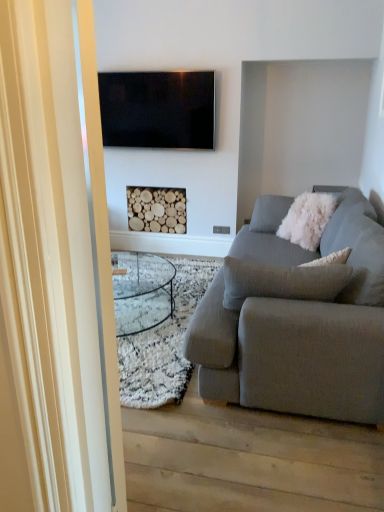
Question: Is textured gray couch at right taller than transparent glass door at left?

Choices:
 (A) yes
 (B) no

Answer: (B)

Question: From a real-world perspective, is textured gray couch at right physically below transparent glass door at left?

Choices:
 (A) yes
 (B) no

Answer: (A)

Question: Would you say textured gray couch at right is a long distance from transparent glass door at left?

Choices:
 (A) no
 (B) yes

Answer: (B)

Question: Does textured gray couch at right have a greater width compared to transparent glass door at left?

Choices:
 (A) no
 (B) yes

Answer: (B)

Question: Is textured gray couch at right not inside transparent glass door at left?

Choices:
 (A) no
 (B) yes

Answer: (B)

Question: Considering the positions of transparent glass door at left and flat screen tv at upper center in the image, is transparent glass door at left wider or thinner than flat screen tv at upper center?

Choices:
 (A) wide
 (B) thin

Answer: (A)

Question: Is point (76, 20) positioned closer to the camera than point (188, 111)?

Choices:
 (A) farther
 (B) closer

Answer: (B)

Question: From a real-world perspective, relative to flat screen tv at upper center, is transparent glass door at left vertically above or below?

Choices:
 (A) above
 (B) below

Answer: (B)

Question: From the image's perspective, relative to flat screen tv at upper center, is transparent glass door at left above or below?

Choices:
 (A) below
 (B) above

Answer: (A)

Question: Considering their positions, is wooden logs at center located in front of or behind white fluffy pillow at right?

Choices:
 (A) behind
 (B) front

Answer: (A)

Question: Considering the positions of point (170, 228) and point (317, 241), is point (170, 228) closer or farther from the camera than point (317, 241)?

Choices:
 (A) farther
 (B) closer

Answer: (A)

Question: Is wooden logs at center bigger or smaller than white fluffy pillow at right?

Choices:
 (A) big
 (B) small

Answer: (B)

Question: In terms of width, does wooden logs at center look wider or thinner when compared to white fluffy pillow at right?

Choices:
 (A) wide
 (B) thin

Answer: (B)

Question: Is point (1, 438) positioned closer to the camera than point (269, 219)?

Choices:
 (A) closer
 (B) farther

Answer: (A)

Question: Visually, is transparent glass door at left positioned to the left or to the right of textured gray couch at right?

Choices:
 (A) right
 (B) left

Answer: (B)